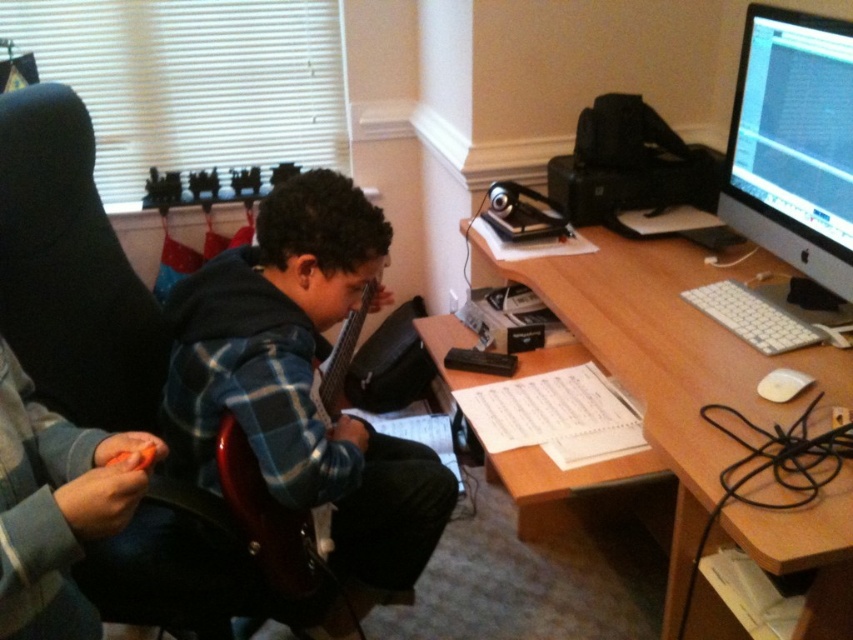
You are a photographer trying to capture a clear shot of the wooden acoustic guitar at center without the orange plastic toy at lower left appearing in the frame. How can you adjust your camera angle to achieve this?

Since the wooden acoustic guitar at center is positioned over the orange plastic toy at lower left, you can lower your camera angle to focus on the guitar while blocking the view of the toy by angling the camera slightly upwards towards the guitar.

You are a delivery person who just arrived at the home office. You need to place a new monitor at the point with coordinates point (793,144). According to the scene description, where should you place the new monitor?

The point (793,144) corresponds to the black glossy monitor at upper right, so you should place the new monitor at the black glossy monitor at upper right.